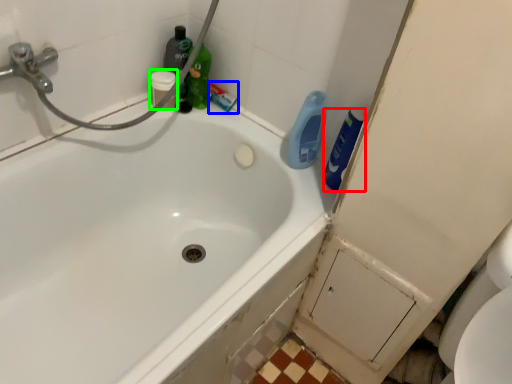
Question: Estimate the real-world distances between objects in this image. Which object is farther from cleaning product (highlighted by a red box), toothpaste (highlighted by a blue box) or toiletry (highlighted by a green box)?

Choices:
 (A) toothpaste
 (B) toiletry

Answer: (B)